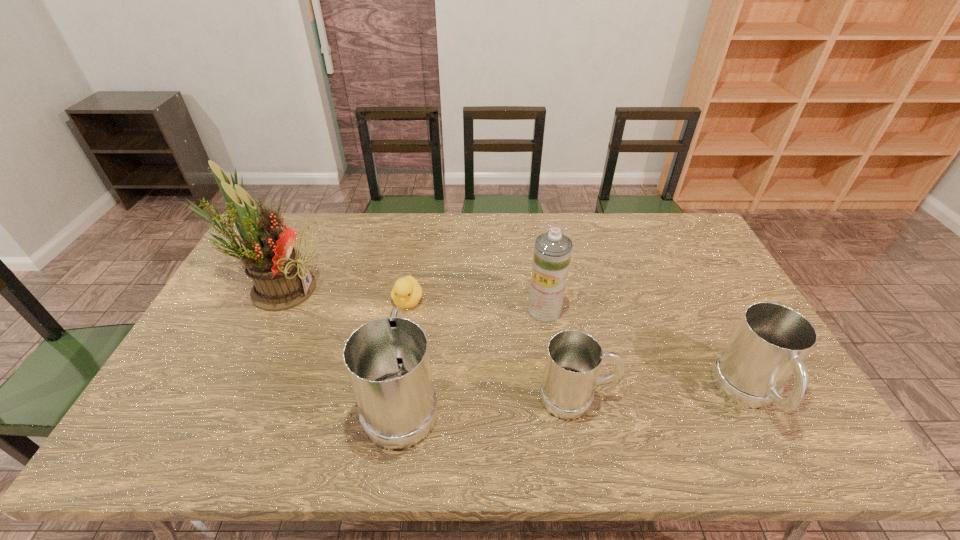
Identify which object is the second nearest to the aerosol can. Please provide its 2D coordinates. Your answer should be formatted as a tuple, i.e. [(x, y)], where the tuple contains the x and y coordinates of a point satisfying the conditions above.

[(387, 360)]

Identify the location of object that is the fourth closest to the aerosol can. The image size is (960, 540). (767, 347).

Where is `mug that stands as the second closest to the leftmost mug`? This screenshot has width=960, height=540. mug that stands as the second closest to the leftmost mug is located at coordinates tap(767, 347).

Select which mug appears as the closest to the leftmost mug. Please provide its 2D coordinates. Your answer should be formatted as a tuple, i.e. [(x, y)], where the tuple contains the x and y coordinates of a point satisfying the conditions above.

[(573, 361)]

This screenshot has height=540, width=960. I want to click on vacant space that satisfies the following two spatial constraints: 1. on the side of the leftmost mug with the handle; 2. in front of the tallest object with the fan visible, so click(x=420, y=288).

I want to click on free space that satisfies the following two spatial constraints: 1. in front of the flower arrangement with the fan visible; 2. on the right side of the aerosol can, so click(267, 310).

Image resolution: width=960 pixels, height=540 pixels. I want to click on free location that satisfies the following two spatial constraints: 1. on the side of the leftmost mug with the handle; 2. on the left side of the aerosol can, so click(x=416, y=310).

What are the coordinates of `free spot that satisfies the following two spatial constraints: 1. on the side of the leftmost mug with the handle; 2. in front of the flower arrangement with the fan visible` in the screenshot? It's located at (420, 288).

Where is `free point that satisfies the following two spatial constraints: 1. on the front-facing side of the aerosol can; 2. on the right side of the shortest object`? The width and height of the screenshot is (960, 540). free point that satisfies the following two spatial constraints: 1. on the front-facing side of the aerosol can; 2. on the right side of the shortest object is located at coordinates (406, 310).

The image size is (960, 540). In order to click on free region that satisfies the following two spatial constraints: 1. in front of the leftmost object with the fan visible; 2. on the side of the leftmost mug with the handle in this screenshot , I will do `click(222, 400)`.